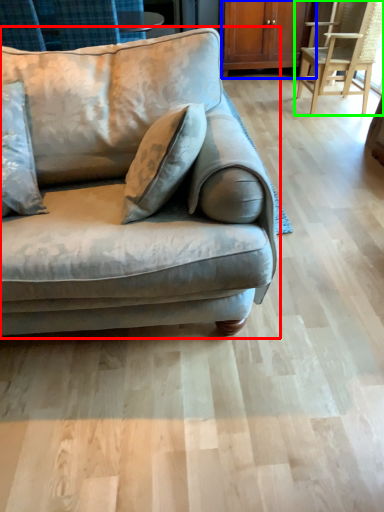
Question: Which is farther away from studio couch (highlighted by a red box)? dresser (highlighted by a blue box) or chair (highlighted by a green box)?

Choices:
 (A) dresser
 (B) chair

Answer: (A)